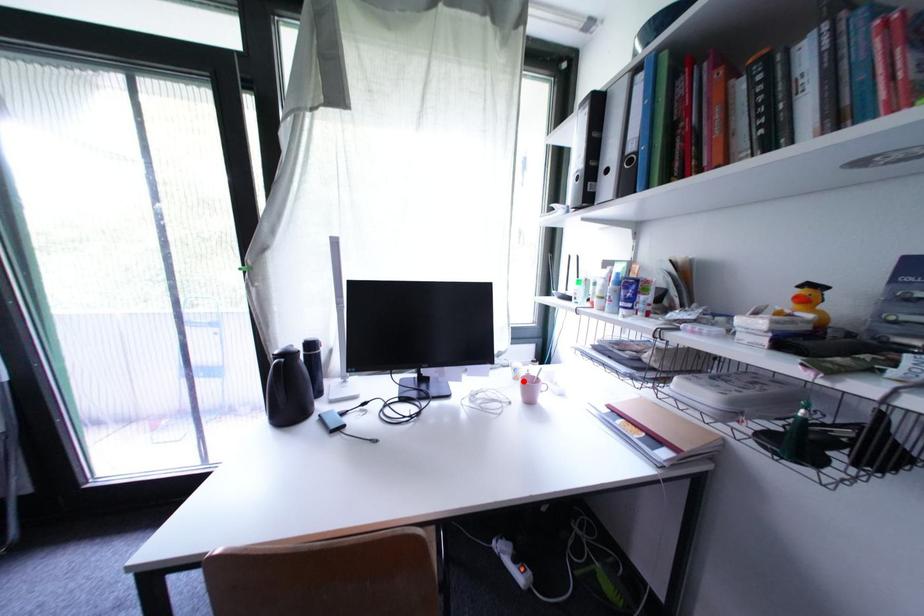
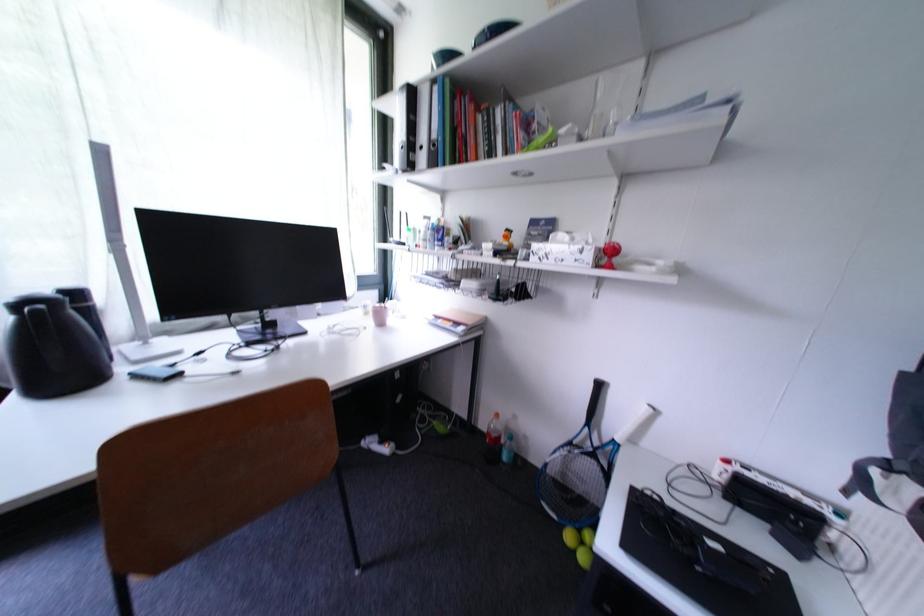
Question: I am providing you with two images of the same scene from different viewpoints. A red point is marked on the first image. At the location where the point appears in image 1, is it still visible in image 2?

Choices:
 (A) Yes
 (B) No

Answer: (A)